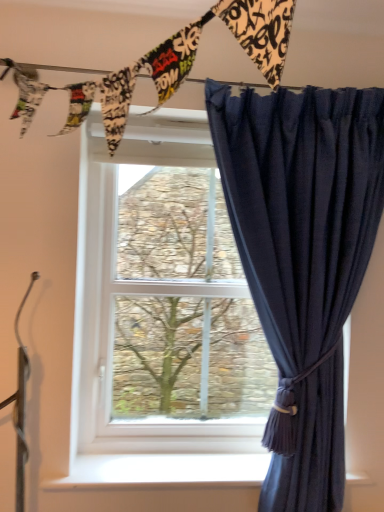
Question: Considering the positions of white plastic window at center and navy blue sheer curtain at right in the image, is white plastic window at center wider or thinner than navy blue sheer curtain at right?

Choices:
 (A) thin
 (B) wide

Answer: (A)

Question: Would you say white plastic window at center is inside or outside navy blue sheer curtain at right?

Choices:
 (A) outside
 (B) inside

Answer: (A)

Question: Which of these objects is positioned closest to the white smooth window sill at lower center?

Choices:
 (A) white plastic window at center
 (B) navy blue sheer curtain at right

Answer: (B)

Question: Which is farther from the white plastic window at center?

Choices:
 (A) navy blue sheer curtain at right
 (B) white smooth window sill at lower center

Answer: (B)